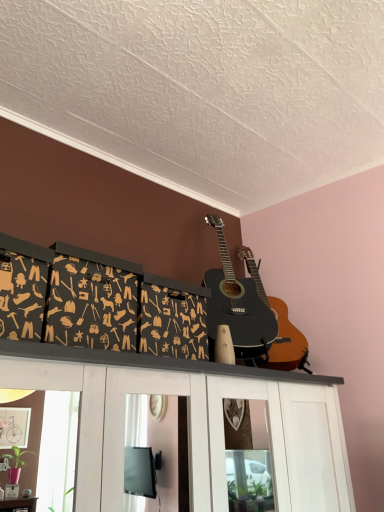
Question: Should I look upward or downward to see dark gray wood storage boxes at upper center?

Choices:
 (A) up
 (B) down

Answer: (B)